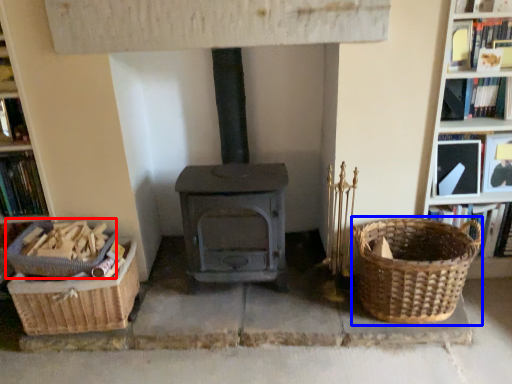
Question: Which point is closer to the camera, basket (highlighted by a red box) or basket (highlighted by a blue box)?

Choices:
 (A) basket
 (B) basket

Answer: (B)